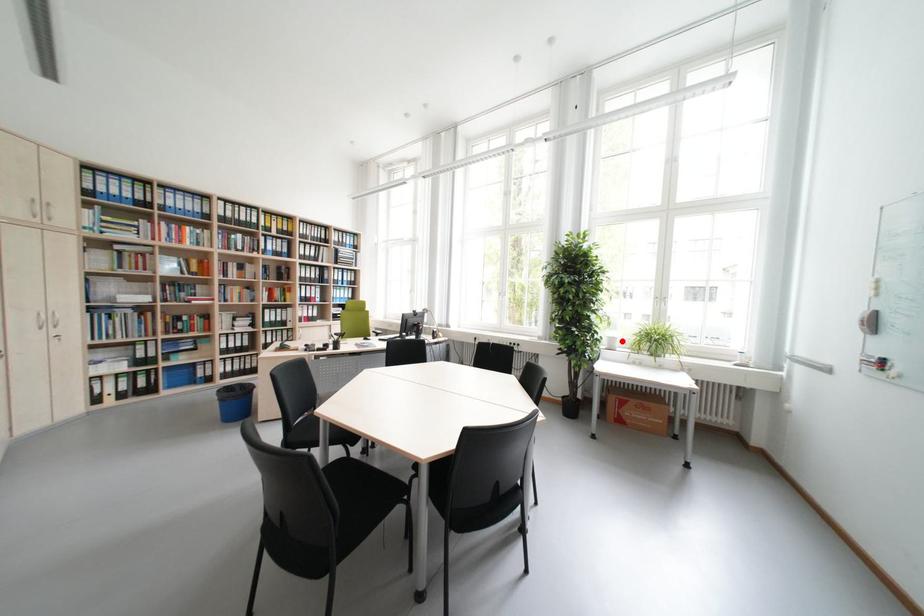
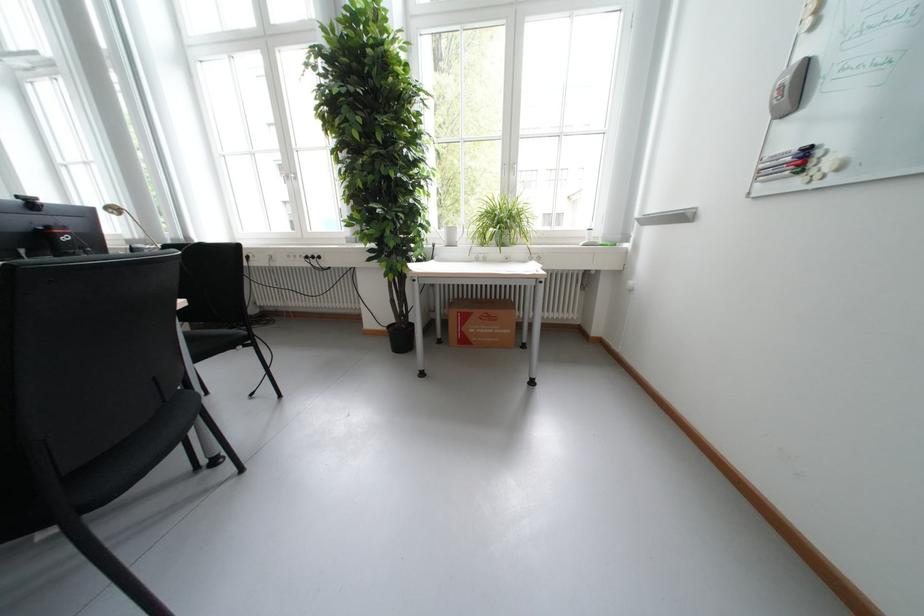
Question: I am providing you with two images of the same scene from different viewpoints. Given a red point in image1, look at the same physical point in image2. Is it:

Choices:
 (A) Closer to the viewpoint
 (B) Farther from the viewpoint

Answer: (A)